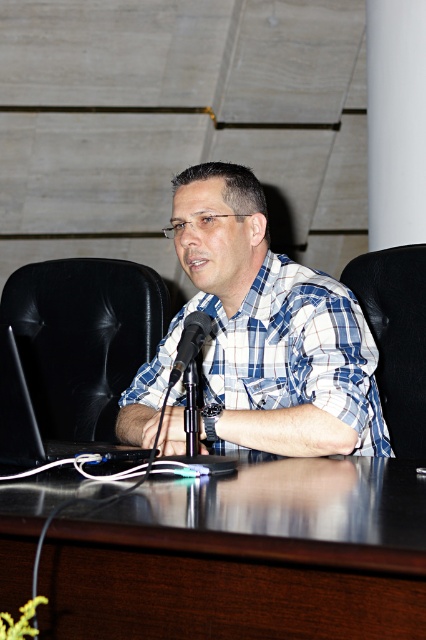
You are a person sitting in the black leather chair at right. You want to reach the black matte laptop at center on the desk. Can you easily reach it from your current position?

The black leather chair at right is positioned over the black matte laptop at center, so you can easily reach it from your current position.

Based on the photo, you are an interior designer assessing the space for ergonomic adjustments. The black leather chair at right and the black matte laptop at center need to be positioned closer together. Given their sizes, which object should be moved first to accommodate the space constraints?

The black leather chair at right should be moved first because it is smaller than the black matte laptop at center, making it easier to adjust its position without requiring significant space changes.

You are organizing a meeting and need to place a 15 inch laptop between the dark wood table at center and the black metallic microphone at center. Can the laptop fit in the space between them?

The distance between the dark wood table at center and the black metallic microphone at center is 14.96 inches. Since the laptop is 15 inches wide, it would not fit in the space between them.